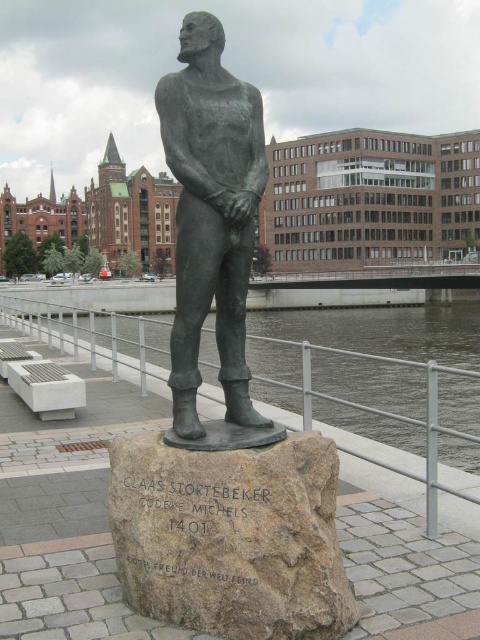
Question: Is bronze statue at center smaller than clear water at statue right?

Choices:
 (A) no
 (B) yes

Answer: (B)

Question: Is brown stone at center to the left of bronze statue at center from the viewer's perspective?

Choices:
 (A) no
 (B) yes

Answer: (A)

Question: Is brown stone at center wider than bronze statue at center?

Choices:
 (A) no
 (B) yes

Answer: (A)

Question: Which of these objects is positioned closest to the clear water at statue right?

Choices:
 (A) brown stone at center
 (B) bronze statue at center

Answer: (A)

Question: Which point is closer to the camera?

Choices:
 (A) clear water at statue right
 (B) brown stone at center
 (C) bronze statue at center

Answer: (B)

Question: Which point appears closest to the camera in this image?

Choices:
 (A) (254, 426)
 (B) (128, 438)

Answer: (A)